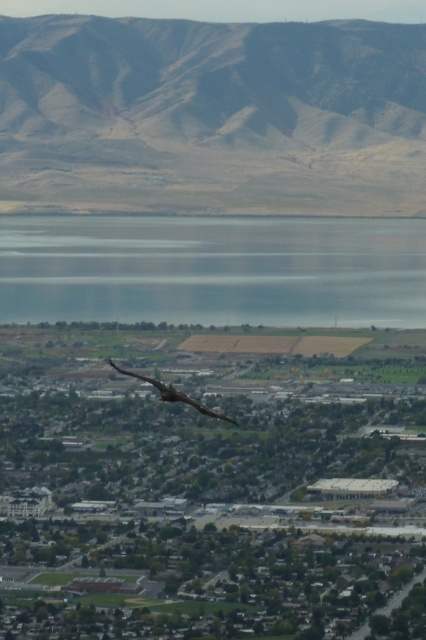
Question: Which point appears farthest from the camera in this image?

Choices:
 (A) (118, 371)
 (B) (85, 29)
 (C) (331, 300)

Answer: (B)

Question: Considering the real-world distances, which object is closest to the brown/drymountain at upper center?

Choices:
 (A) dark brown feathers at center
 (B) blue glass water at center

Answer: (B)

Question: Is the position of brown/drymountain at upper center more distant than that of dark brown feathers at center?

Choices:
 (A) yes
 (B) no

Answer: (A)

Question: Among these points, which one is nearest to the camera?

Choices:
 (A) (180, 125)
 (B) (345, 282)
 (C) (190, 403)

Answer: (C)

Question: Does brown/drymountain at upper center appear over dark brown feathers at center?

Choices:
 (A) yes
 (B) no

Answer: (A)

Question: Where is blue glass water at center located in relation to dark brown feathers at center in the image?

Choices:
 (A) right
 (B) left

Answer: (A)